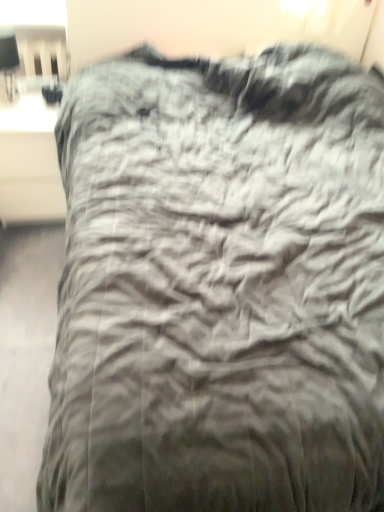
Describe the element at coordinates (29, 162) in the screenshot. I see `matte white table at left` at that location.

Find the location of `matte white table at left`. matte white table at left is located at coordinates (29, 162).

Measure the distance between matte white table at left and camera.

matte white table at left and camera are 4.36 feet apart from each other.

I want to click on matte black lampshade at upper left, so click(9, 63).

This screenshot has width=384, height=512. Describe the element at coordinates (9, 63) in the screenshot. I see `matte black lampshade at upper left` at that location.

Looking at this image, measure the distance between point [16,63] and camera.

Point [16,63] and camera are 3.29 feet apart from each other.

Identify the location of matte white table at left. Image resolution: width=384 pixels, height=512 pixels. (29, 162).

Does matte black lampshade at upper left appear on the right side of matte white table at left?

Incorrect, matte black lampshade at upper left is not on the right side of matte white table at left.

Considering their positions, is matte black lampshade at upper left located in front of or behind matte white table at left?

In the image, matte black lampshade at upper left appears in front of matte white table at left.

Is point (14, 74) closer or farther from the camera than point (49, 130)?

Point (14, 74) is closer to the camera than point (49, 130).

From the image's perspective, does matte black lampshade at upper left appear lower than matte white table at left?

Actually, matte black lampshade at upper left appears above matte white table at left in the image.

From a real-world perspective, is matte black lampshade at upper left below matte white table at left?

No.

Can you confirm if matte black lampshade at upper left is thinner than matte white table at left?

Indeed, matte black lampshade at upper left has a lesser width compared to matte white table at left.

Who is taller, matte black lampshade at upper left or matte white table at left?

With more height is matte white table at left.

Considering the sizes of matte black lampshade at upper left and matte white table at left in the image, is matte black lampshade at upper left bigger or smaller than matte white table at left?

Clearly, matte black lampshade at upper left is smaller in size than matte white table at left.

Which is correct: matte black lampshade at upper left is inside matte white table at left, or outside of it?

matte black lampshade at upper left is outside matte white table at left.

Is matte black lampshade at upper left directly adjacent to matte white table at left?

There is a gap between matte black lampshade at upper left and matte white table at left.

Is matte black lampshade at upper left looking in the opposite direction of matte white table at left?

No.

In the image, there is a matte black lampshade at upper left. Find the location of `table below it (from a real-world perspective)`. table below it (from a real-world perspective) is located at coordinates (29, 162).

Consider the image. In the image, is matte white table at left on the left side or the right side of matte black lampshade at upper left?

Based on their positions, matte white table at left is located to the right of matte black lampshade at upper left.

Does matte white table at left lie in front of matte black lampshade at upper left?

No, matte white table at left is behind matte black lampshade at upper left.

Is point (31, 162) positioned after point (5, 45)?

Yes, it is.

From the image's perspective, is matte white table at left beneath matte black lampshade at upper left?

Yes, from the image's perspective, matte white table at left is beneath matte black lampshade at upper left.

From a real-world perspective, is matte white table at left above or below matte black lampshade at upper left?

matte white table at left is below matte black lampshade at upper left.

Considering the sizes of matte white table at left and matte black lampshade at upper left in the image, is matte white table at left wider or thinner than matte black lampshade at upper left?

Clearly, matte white table at left has more width compared to matte black lampshade at upper left.

Which of these two, matte white table at left or matte black lampshade at upper left, stands taller?

matte white table at left is taller.

Between matte white table at left and matte black lampshade at upper left, which one has larger size?

matte white table at left.

Would you say matte white table at left is inside or outside matte black lampshade at upper left?

matte white table at left is located beyond the bounds of matte black lampshade at upper left.

Is matte white table at left beside matte black lampshade at upper left?

matte white table at left and matte black lampshade at upper left are not in contact.

In the scene shown: Is matte black lampshade at upper left at the back of matte white table at left?

That's not correct — matte white table at left is not looking away from matte black lampshade at upper left.

What's the angular difference between matte white table at left and matte black lampshade at upper left's facing directions?

→ 0.842 degrees.

In the image, there is a matte black lampshade at upper left. What are the coordinates of `table below it (from a real-world perspective)` in the screenshot? It's located at (29, 162).

At what (x,y) coordinates should I click in order to perform the action: click on table located underneath the matte black lampshade at upper left (from a real-world perspective). Please return your answer as a coordinate pair (x, y). Looking at the image, I should click on (29, 162).

The image size is (384, 512). I want to click on table lamp in front of the matte white table at left, so click(9, 63).